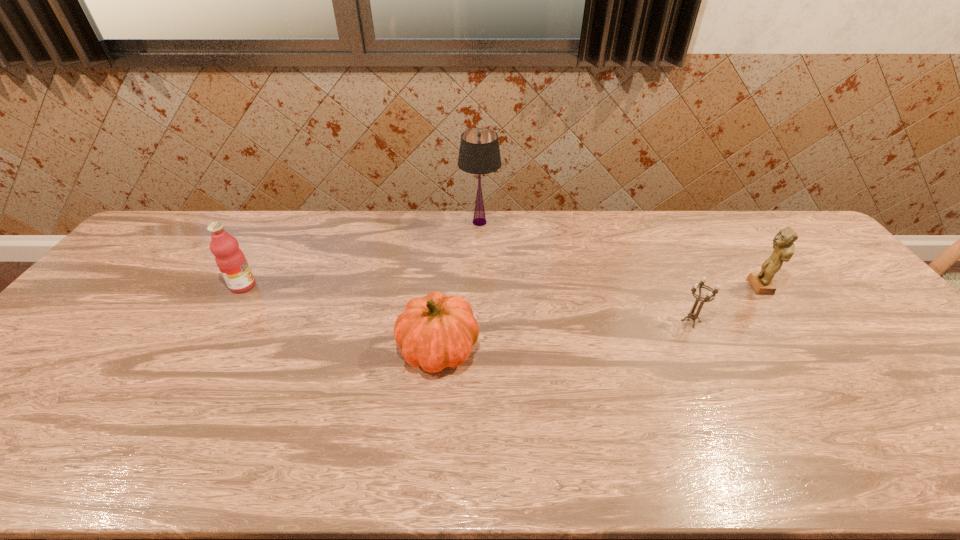
Find the location of `free area in between the shortest object and the rightmost object`. free area in between the shortest object and the rightmost object is located at coordinates (725, 304).

Identify the location of vacant area that lies between the tallest object and the leftmost object. (361, 254).

Identify the location of vacant space in between the rightmost object and the second shortest object. Image resolution: width=960 pixels, height=540 pixels. (598, 318).

Image resolution: width=960 pixels, height=540 pixels. Identify the location of vacant space that's between the pumpkin and the shortest object. (564, 335).

Locate an element on the screen. Image resolution: width=960 pixels, height=540 pixels. vacant space that is in between the fruit juice and the farthest object is located at coordinates (x=361, y=254).

The height and width of the screenshot is (540, 960). In order to click on unoccupied position between the fruit juice and the rightmost object in this screenshot , I will do click(501, 286).

Find the location of a particular element. The width and height of the screenshot is (960, 540). vacant region between the rightmost object and the fourth tallest object is located at coordinates (598, 318).

You are a GUI agent. You are given a task and a screenshot of the screen. Output one action in this format:
    pyautogui.click(x=<x>, y=<y>)
    Task: Click on the free point between the pumpkin and the tallest object
    The image size is (960, 540).
    Given the screenshot: What is the action you would take?
    pyautogui.click(x=459, y=286)

Choose which object is the nearest neighbor to the shortest object. Please provide its 2D coordinates. Your answer should be formatted as a tuple, i.e. [(x, y)], where the tuple contains the x and y coordinates of a point satisfying the conditions above.

[(783, 244)]

Find the location of a particular element. object that is the closest to the candle holder is located at coordinates (783, 244).